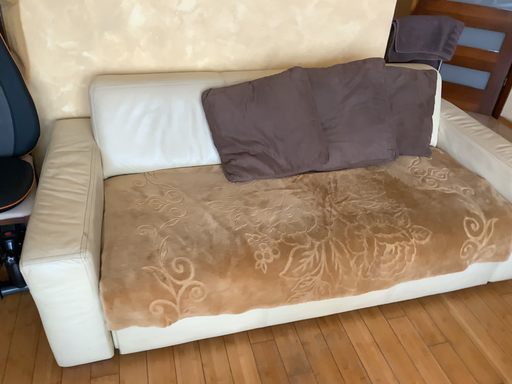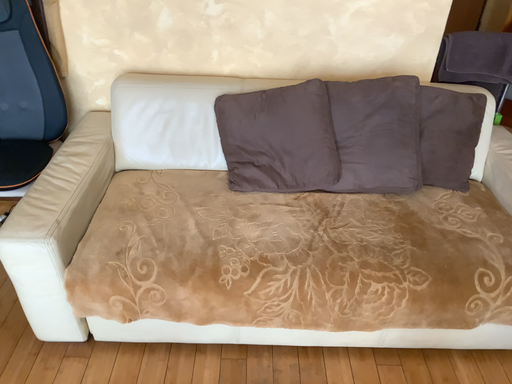
Question: How did the camera likely rotate when shooting the video?

Choices:
 (A) rotated left
 (B) rotated right

Answer: (A)